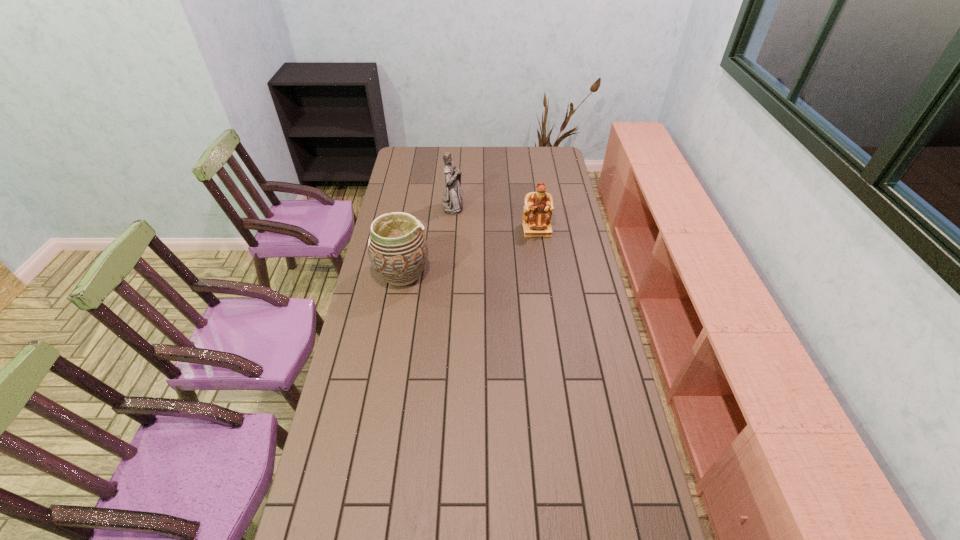
Identify which object is the second closest to the leftmost object. Please provide its 2D coordinates. Your answer should be formatted as a tuple, i.e. [(x, y)], where the tuple contains the x and y coordinates of a point satisfying the conditions above.

[(538, 208)]

This screenshot has width=960, height=540. Find the location of `the closest figurine to the leftmost object`. the closest figurine to the leftmost object is located at coordinates (452, 204).

You are a GUI agent. You are given a task and a screenshot of the screen. Output one action in this format:
    pyautogui.click(x=<x>, y=<y>)
    Task: Click on the blank area in the image that satisfies the following two spatial constraints: 1. on the front-facing side of the farthest object; 2. on the front side of the leftmost object
    This screenshot has height=540, width=960.
    Given the screenshot: What is the action you would take?
    pyautogui.click(x=448, y=273)

The width and height of the screenshot is (960, 540). Identify the location of vacant space that satisfies the following two spatial constraints: 1. on the front-facing side of the farthest object; 2. on the front side of the nearest object. (448, 273).

The height and width of the screenshot is (540, 960). Find the location of `vacant point that satisfies the following two spatial constraints: 1. on the front-facing side of the farthest object; 2. on the front side of the leftmost object`. vacant point that satisfies the following two spatial constraints: 1. on the front-facing side of the farthest object; 2. on the front side of the leftmost object is located at coordinates (448, 273).